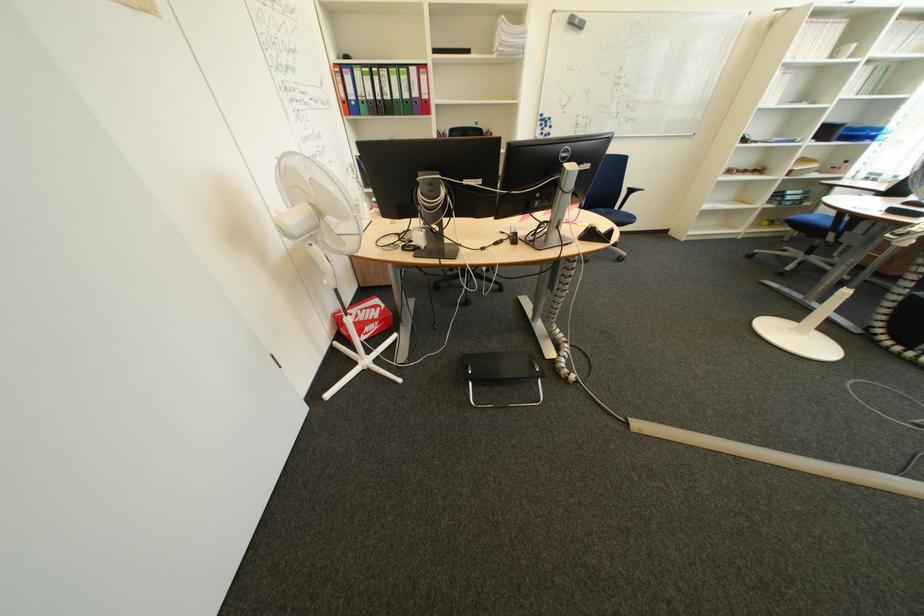
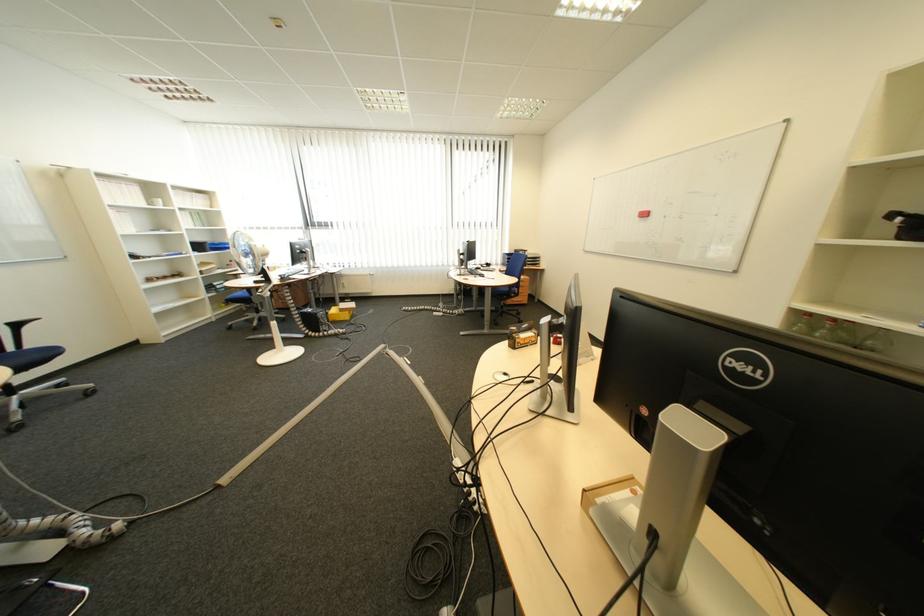
In the second image, find the point that corresponds to (x=835, y=59) in the first image.

(155, 206)